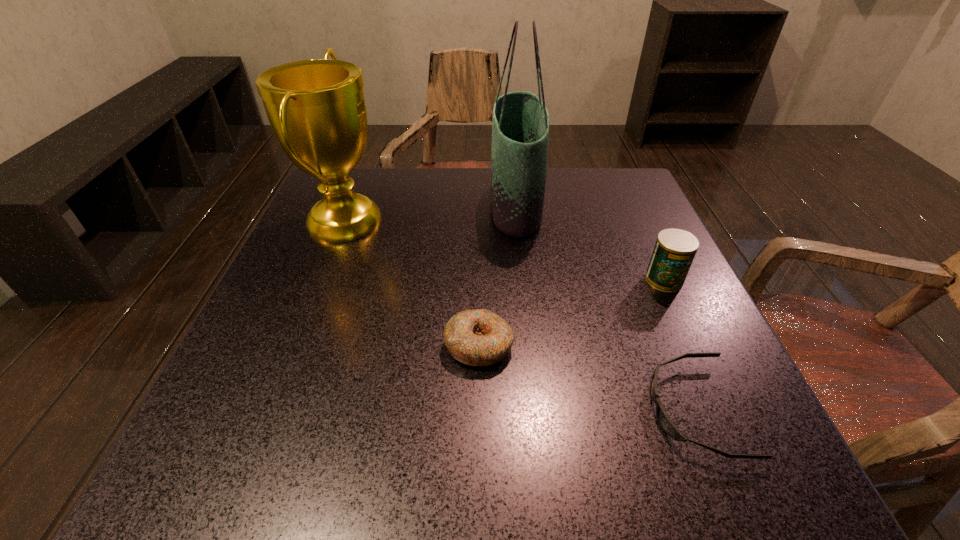
What are the coordinates of `blank region between the can and the award` in the screenshot? It's located at (505, 249).

Locate an element on the screen. The image size is (960, 540). vacant area that lies between the award and the can is located at coordinates (505, 249).

Where is `free spot between the can and the tallest object`? Image resolution: width=960 pixels, height=540 pixels. free spot between the can and the tallest object is located at coordinates (589, 242).

Find the location of a particular element. vacant region between the tallest object and the sunglasses is located at coordinates (605, 307).

Locate an element on the screen. Image resolution: width=960 pixels, height=540 pixels. vacant area that lies between the second shortest object and the can is located at coordinates (571, 312).

Where is `vacant point located between the third tallest object and the doughnut`? vacant point located between the third tallest object and the doughnut is located at coordinates (571, 312).

This screenshot has width=960, height=540. In order to click on vacant space that's between the can and the doughnut in this screenshot , I will do `click(571, 312)`.

The image size is (960, 540). In order to click on vacant area that lies between the leftmost object and the can in this screenshot , I will do `click(505, 249)`.

Identify which object is located as the second nearest to the doughnut. Please provide its 2D coordinates. Your answer should be formatted as a tuple, i.e. [(x, y)], where the tuple contains the x and y coordinates of a point satisfying the conditions above.

[(316, 108)]

Identify which object is located as the fourth nearest to the doughnut. Please provide its 2D coordinates. Your answer should be formatted as a tuple, i.e. [(x, y)], where the tuple contains the x and y coordinates of a point satisfying the conditions above.

[(675, 249)]